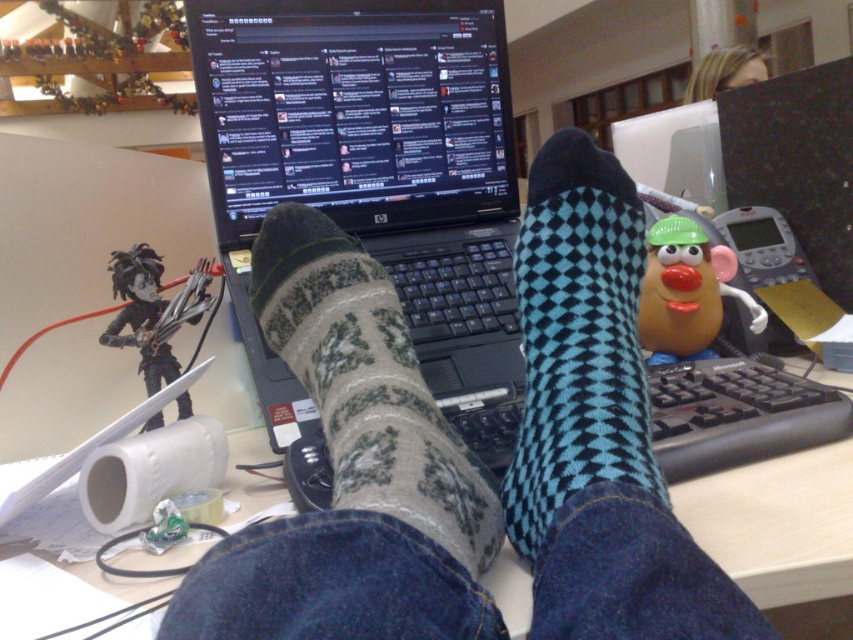
Looking at this image, you are organizing a desk and want to place the white paper at center and the black plastic keyboard at center vertically. Which object should be placed higher on the desk to ensure proper visibility?

The white paper at center should be placed higher since it has a greater height compared to the black plastic keyboard at center.

You are a photographer taking a picture of the teal checkered sock at center and the black matte figure at center. Which object should you focus on first to ensure both are in sharp focus?

The teal checkered sock at center is closer to the viewer than the black matte figure at center. To ensure both are in sharp focus, focus on the teal checkered sock at center first because it is closer, allowing the depth of field to extend to the farther object.